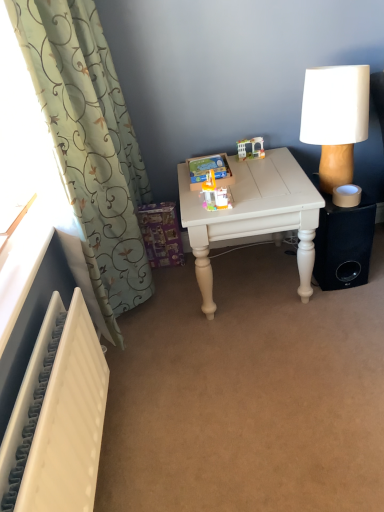
Locate an element on the screen. vacant space that's between black matte speaker at lower right and white textured radiator at lower left is located at coordinates (223, 366).